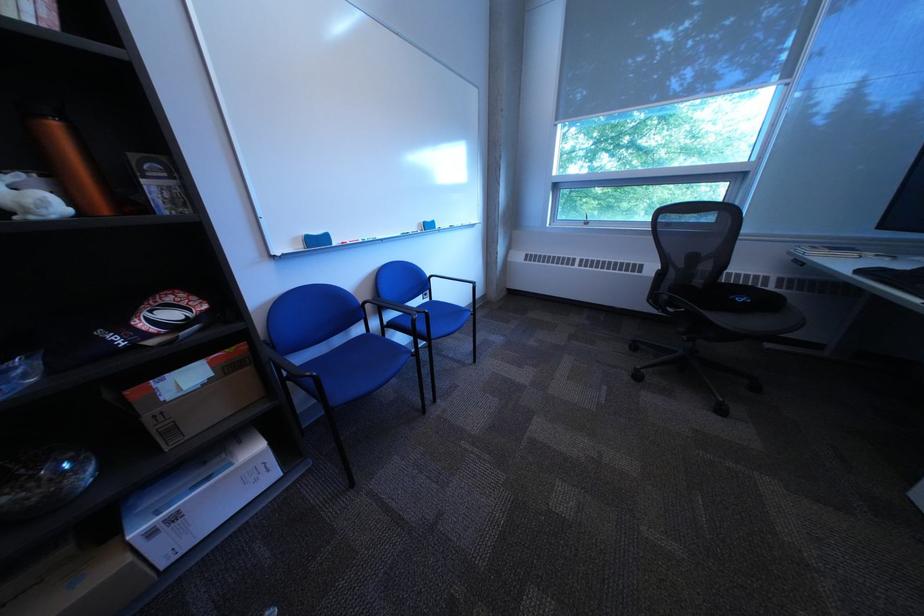
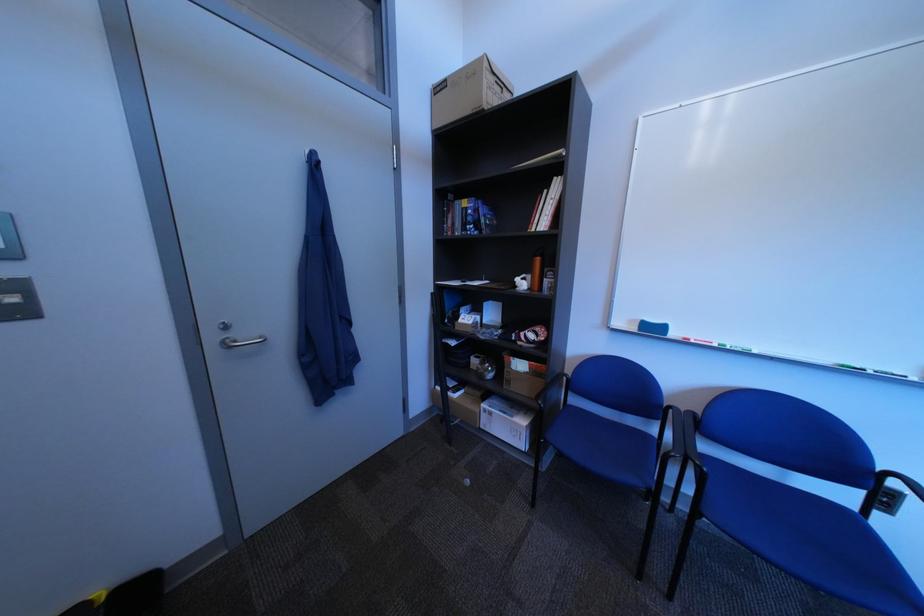
In the second image, find the point that corresponds to (377,243) in the first image.

(732, 347)